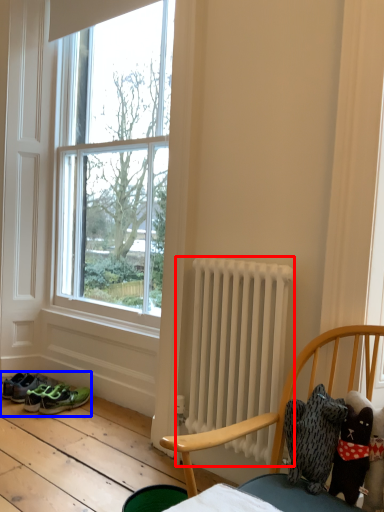
Question: Which object is further to the camera taking this photo, radiator (highlighted by a red box) or footwear (highlighted by a blue box)?

Choices:
 (A) radiator
 (B) footwear

Answer: (B)